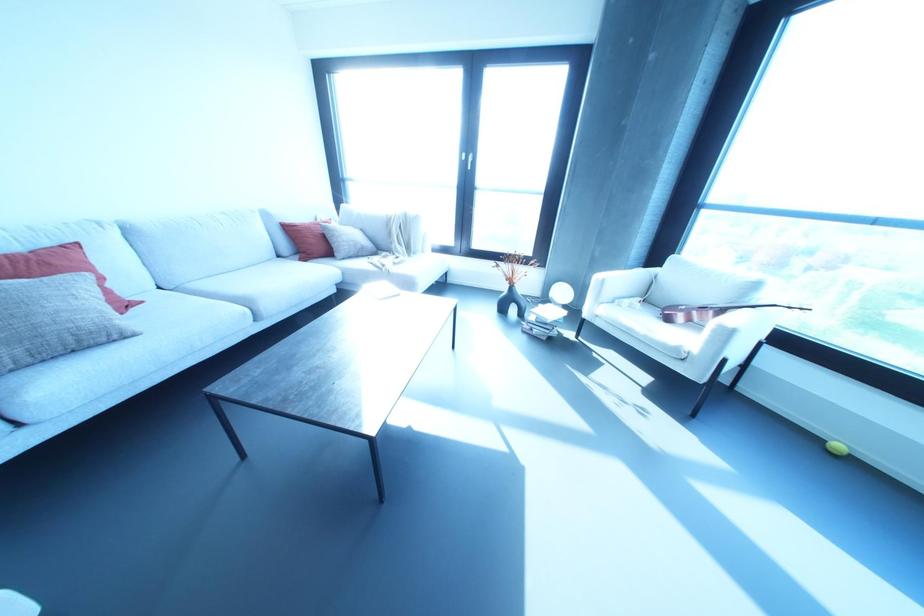
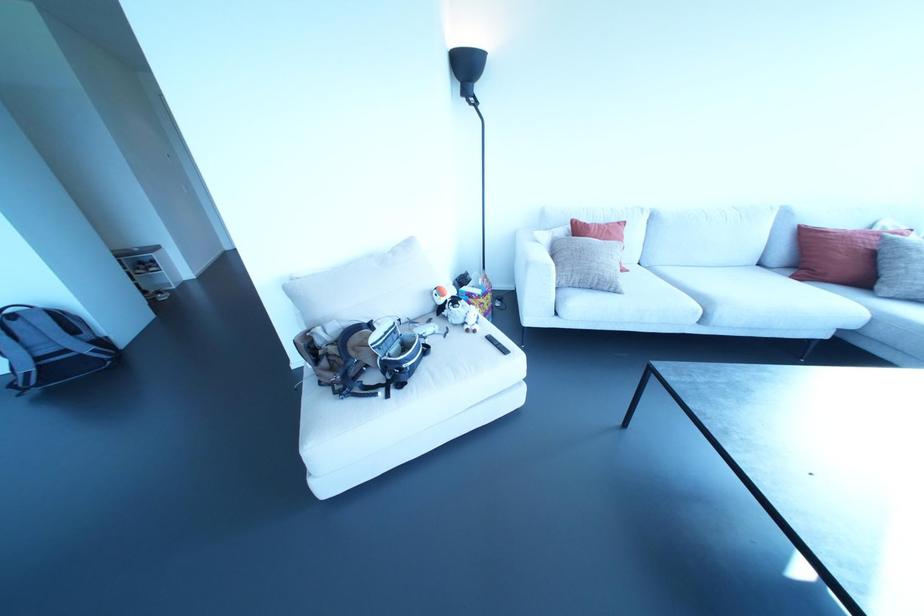
Where in the second image is the point corresponding to (x=256, y=317) from the first image?

(701, 320)